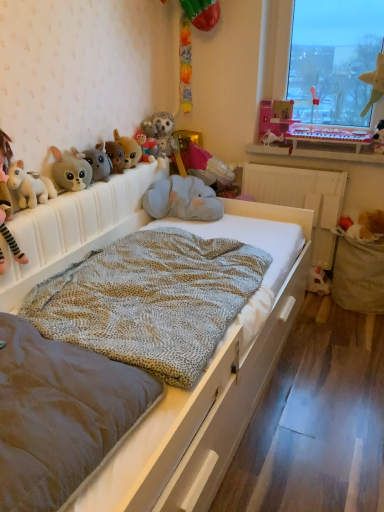
This screenshot has height=512, width=384. Find the location of `fluffy plush toy at center, the fifth toy in the left-to-right sequence`. fluffy plush toy at center, the fifth toy in the left-to-right sequence is located at coordinates (147, 146).

Image resolution: width=384 pixels, height=512 pixels. Identify the location of white wood bed frame at center. (303, 205).

The height and width of the screenshot is (512, 384). In order to click on textured beige blanket at center in this screenshot , I will do `click(151, 300)`.

At what (x,y) coordinates should I click in order to perform the action: click on soft gray plush elephant at center, placed as the 7th toy when sorted from left to right. Please return your answer as a coordinate pair (x, y). Looking at the image, I should click on (182, 199).

Describe the element at coordinates (182, 199) in the screenshot. I see `soft gray plush elephant at center, placed as the 7th toy when sorted from left to right` at that location.

Where is `pink plastic doll at upper right, the 10th toy from the left`? pink plastic doll at upper right, the 10th toy from the left is located at coordinates (275, 119).

The height and width of the screenshot is (512, 384). What are the coordinates of `white plush toy at upper center, which is the 5th toy in right-to-left order` in the screenshot? It's located at (272, 138).

Which is nearer, [1,166] or [154,117]?

Clearly, point [1,166] is closer to the camera than point [154,117].

Is the position of white plush unicorn at left less distant than that of fluffy gray owl at center, acting as the 8th toy starting from the right?

Yes, it is in front of fluffy gray owl at center, acting as the 8th toy starting from the right.

Is white plush unicorn at left aimed at fluffy gray owl at center, which is counted as the 6th toy, starting from the left?

No, white plush unicorn at left is not turned towards fluffy gray owl at center, which is counted as the 6th toy, starting from the left.

Based on the photo, from the image's perspective, would you say white plush unicorn at left is positioned over fluffy gray owl at center, acting as the 8th toy starting from the right?

Actually, white plush unicorn at left appears below fluffy gray owl at center, acting as the 8th toy starting from the right, in the image.

Consider the image. Does transparent glass window at upper right have a lesser height compared to white plush unicorn at left, which is the 1th toy from left to right?

No.

From the image's perspective, between transparent glass window at upper right and white plush unicorn at left, the thirteenth toy from the right, which one is located above?

transparent glass window at upper right appears higher in the image.

In the image, is transparent glass window at upper right positioned in front of or behind white plush unicorn at left, which is the 1th toy from left to right?

Clearly, transparent glass window at upper right is behind white plush unicorn at left, which is the 1th toy from left to right.

How many degrees apart are the facing directions of transparent glass window at upper right and white plush unicorn at left, which is the 1th toy from left to right?

They differ by 87.4 degrees in their facing directions.

Considering the positions of objects white plush toy at upper center, which is the ninth toy in left-to-right order, and white plush unicorn at left, the thirteenth toy from the right, in the image provided, who is in front, white plush toy at upper center, which is the ninth toy in left-to-right order, or white plush unicorn at left, the thirteenth toy from the right,?

white plush unicorn at left, the thirteenth toy from the right, is more forward.

What are the coordinates of `the 12th toy behind the white plush unicorn at left, the thirteenth toy from the right` in the screenshot? It's located at (272, 138).

How distant is white plush toy at upper center, which is the 5th toy in right-to-left order, from white plush unicorn at left, the thirteenth toy from the right?

They are 1.49 meters apart.

Does textured beige blanket at center turn towards soft gray plush elephant at center, which is counted as the seventh toy, starting from the right?

No.

Considering the sizes of textured beige blanket at center and soft gray plush elephant at center, which is counted as the seventh toy, starting from the right, in the image, is textured beige blanket at center wider or thinner than soft gray plush elephant at center, which is counted as the seventh toy, starting from the right,?

Clearly, textured beige blanket at center has more width compared to soft gray plush elephant at center, which is counted as the seventh toy, starting from the right.

Is textured beige blanket at center positioned behind soft gray plush elephant at center, placed as the 7th toy when sorted from left to right?

No, it is not.

Would you consider textured beige blanket at center to be distant from soft gray plush elephant at center, placed as the 7th toy when sorted from left to right?

No, there isn't a large distance between textured beige blanket at center and soft gray plush elephant at center, placed as the 7th toy when sorted from left to right.

Looking at this image, in the image, is velvet plush elephant at center, which is the eighth toy in left-to-right order, positioned in front of or behind white plush unicorn at left?

In the image, velvet plush elephant at center, which is the eighth toy in left-to-right order, appears behind white plush unicorn at left.

How many degrees apart are the facing directions of velvet plush elephant at center, which is the eighth toy in left-to-right order, and white plush unicorn at left?

0.000279 degrees separate the facing orientations of velvet plush elephant at center, which is the eighth toy in left-to-right order, and white plush unicorn at left.

Is velvet plush elephant at center, which is the eighth toy in left-to-right order, touching white plush unicorn at left?

No.

Considering the points (188, 149) and (2, 218), which point is in front, point (188, 149) or point (2, 218)?

Point (2, 218)

Identify the location of window sill that appears behind the fluffy plush toy at center, the 9th toy positioned from the right. (314, 153).

Could you measure the distance between fluffy plush toy at center, the fifth toy in the left-to-right sequence, and white plastic keyboard at upper right?

fluffy plush toy at center, the fifth toy in the left-to-right sequence, and white plastic keyboard at upper right are 32.29 inches apart.

Does point (146, 136) lie behind point (368, 162)?

No, it is in front of (368, 162).

Which object is positioned more to the left, fluffy plush toy at center, the fifth toy in the left-to-right sequence, or white plastic keyboard at upper right?

Positioned to the left is fluffy plush toy at center, the fifth toy in the left-to-right sequence.

Considering the points (156, 217) and (196, 147), which point is in front, point (156, 217) or point (196, 147)?

The point (156, 217) is more forward.

How many degrees apart are the facing directions of soft gray plush elephant at center, placed as the 7th toy when sorted from left to right, and velvet plush elephant at center, placed as the sixth toy when sorted from right to left?

The angular difference between soft gray plush elephant at center, placed as the 7th toy when sorted from left to right, and velvet plush elephant at center, placed as the sixth toy when sorted from right to left, is 0.000877 degrees.

Based on their positions, is soft gray plush elephant at center, which is counted as the seventh toy, starting from the right, located to the left or right of velvet plush elephant at center, placed as the sixth toy when sorted from right to left?

From the image, it's evident that soft gray plush elephant at center, which is counted as the seventh toy, starting from the right, is to the left of velvet plush elephant at center, placed as the sixth toy when sorted from right to left.

Is soft gray plush elephant at center, placed as the 7th toy when sorted from left to right, not close to velvet plush elephant at center, which is the eighth toy in left-to-right order?

soft gray plush elephant at center, placed as the 7th toy when sorted from left to right, is near velvet plush elephant at center, which is the eighth toy in left-to-right order, not far away.

The width and height of the screenshot is (384, 512). Identify the location of child on the left side of fluffy gray owl at center, which is counted as the 6th toy, starting from the left. (9, 231).

You are a GUI agent. You are given a task and a screenshot of the screen. Output one action in this format:
    pyautogui.click(x=<x>, y=<y>)
    Task: Click on the toy that is the 5th object directly below the transparent glass window at upper right (from a real-world perspective)
    This screenshot has width=384, height=512.
    Given the screenshot: What is the action you would take?
    pyautogui.click(x=29, y=186)

From the image, which object appears to be farther from fluffy plush toy at center, the fifth toy in the left-to-right sequence, velvet grey mattress at center or soft gray plush elephant at center, placed as the 7th toy when sorted from left to right?

velvet grey mattress at center is positioned further to the anchor fluffy plush toy at center, the fifth toy in the left-to-right sequence.

Consider the image. From the image, which object appears to be nearer to pink plastic doll at upper right, which appears as the 4th toy when viewed from the right, fluffy gray plush at upper left, which is the 11th toy from right to left, or white plush toy at upper center, which is the 5th toy in right-to-left order?

Based on the image, white plush toy at upper center, which is the 5th toy in right-to-left order, appears to be nearer to pink plastic doll at upper right, which appears as the 4th toy when viewed from the right.

From the image, which object appears to be nearer to white plush toy at upper center, which is the 5th toy in right-to-left order, soft gray plush elephant at center, placed as the 7th toy when sorted from left to right, or white plastic keyboard at upper right?

Among the two, white plastic keyboard at upper right is located nearer to white plush toy at upper center, which is the 5th toy in right-to-left order.

Looking at the image, which one is located closer to velvet grey mattress at center, white wooden bed at center or fluffy gray plush at upper left, which is the 11th toy from right to left?

white wooden bed at center.

Based on their spatial positions, is fluffy gray plush at upper left, the 3th toy in the left-to-right sequence, or green felt star at upper right, which ranks as the 3th toy in right-to-left order, further from fuzzy brown plush dog at upper center, positioned as the 4th toy in left-to-right order?

green felt star at upper right, which ranks as the 3th toy in right-to-left order, lies further to fuzzy brown plush dog at upper center, positioned as the 4th toy in left-to-right order, than the other object.

Which object lies nearer to the anchor point transparent glass window at upper right, fluffy gray plush at upper left, which is the 11th toy from right to left, or white wood bed frame at center?

white wood bed frame at center lies closer to transparent glass window at upper right than the other object.

From the image, which object appears to be nearer to brown plush toy at right, the 2th toy viewed from the right, white wooden bed at center or transparent glass window at upper right?

Among the two, transparent glass window at upper right is located nearer to brown plush toy at right, the 2th toy viewed from the right.

When comparing their distances from fluffy gray owl at center, which is counted as the 6th toy, starting from the left, does transparent glass window at upper right or velvet plush elephant at center, placed as the sixth toy when sorted from right to left, seem closer?

velvet plush elephant at center, placed as the sixth toy when sorted from right to left, lies closer to fluffy gray owl at center, which is counted as the 6th toy, starting from the left, than the other object.

The width and height of the screenshot is (384, 512). I want to click on window screen between velvet grey mattress at center and velvet plush elephant at center, which is the eighth toy in left-to-right order, along the z-axis, so click(x=334, y=58).

Where is `bed frame located between velvet grey mattress at center and white plastic keyboard at upper right in the depth direction`? This screenshot has width=384, height=512. bed frame located between velvet grey mattress at center and white plastic keyboard at upper right in the depth direction is located at coordinates (303, 205).

Where is `window screen positioned between white wooden bed at center and white wood bed frame at center from near to far`? Image resolution: width=384 pixels, height=512 pixels. window screen positioned between white wooden bed at center and white wood bed frame at center from near to far is located at coordinates (334, 58).

Locate an element on the screen. Image resolution: width=384 pixels, height=512 pixels. blanket between fluffy gray plush at upper left, which is the 11th toy from right to left, and white plastic keyboard at upper right is located at coordinates (151, 300).